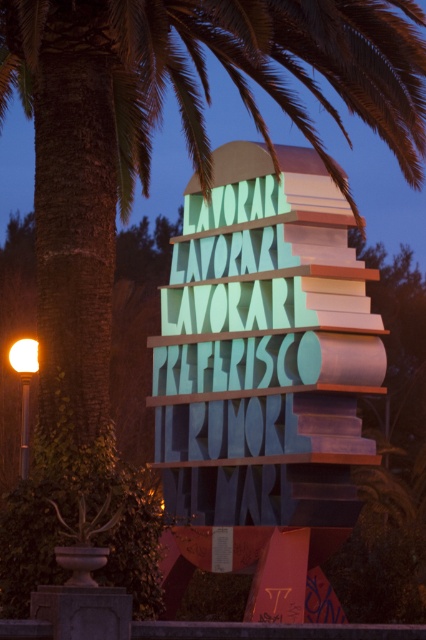
Question: Can you confirm if multicolored plastic sign at center is positioned to the left of matte yellow light at left?

Choices:
 (A) no
 (B) yes

Answer: (A)

Question: Which object is farther from the camera taking this photo?

Choices:
 (A) matte yellow light at left
 (B) multicolored plastic sign at center

Answer: (A)

Question: Among these objects, which one is farthest from the camera?

Choices:
 (A) matte yellow light at left
 (B) multicolored plastic sign at center

Answer: (A)

Question: Is multicolored plastic sign at center smaller than matte yellow light at left?

Choices:
 (A) yes
 (B) no

Answer: (B)

Question: Can you confirm if multicolored plastic sign at center is thinner than matte yellow light at left?

Choices:
 (A) no
 (B) yes

Answer: (A)